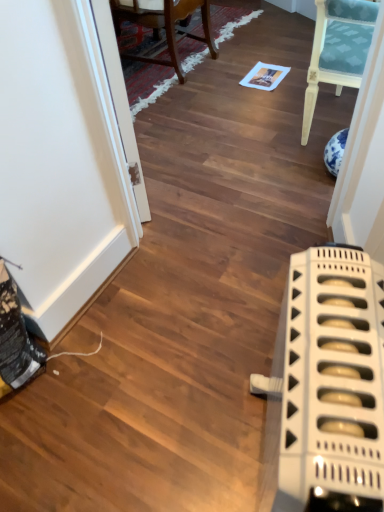
This screenshot has height=512, width=384. Find the location of `free point to the right of wooden chair at upper center`. free point to the right of wooden chair at upper center is located at coordinates (255, 64).